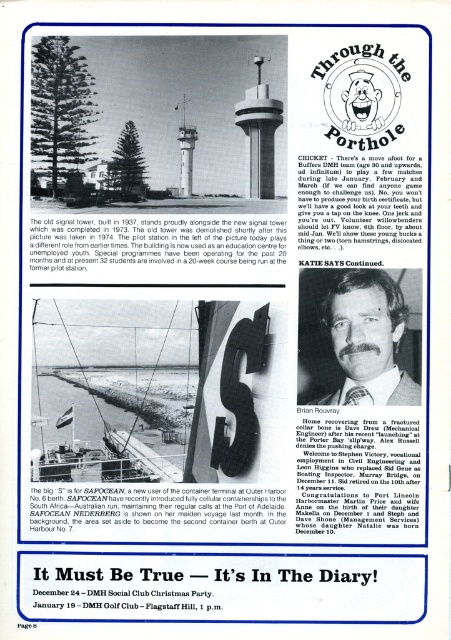
Question: Is dark brown suit at center bigger than smooth concrete tower at center?

Choices:
 (A) no
 (B) yes

Answer: (B)

Question: Which point appears closest to the camera in this image?

Choices:
 (A) (254, 122)
 (B) (385, 376)

Answer: (B)

Question: Estimate the real-world distances between objects in this image. Which object is farther from the dark brown suit at center?

Choices:
 (A) white concrete tower at center
 (B) smooth concrete tower at center

Answer: (A)

Question: Can you confirm if dark brown suit at center is thinner than smooth concrete tower at center?

Choices:
 (A) yes
 (B) no

Answer: (B)

Question: Does dark brown suit at center lie in front of smooth concrete tower at center?

Choices:
 (A) no
 (B) yes

Answer: (B)

Question: Which of the following is the closest to the observer?

Choices:
 (A) (276, 106)
 (B) (183, 168)

Answer: (A)